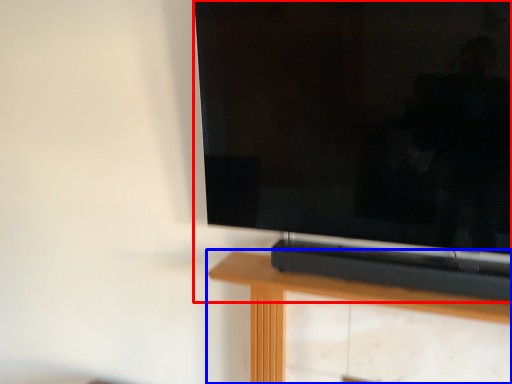
Question: Which point is further to the camera, television (highlighted by a red box) or furniture (highlighted by a blue box)?

Choices:
 (A) television
 (B) furniture

Answer: (B)